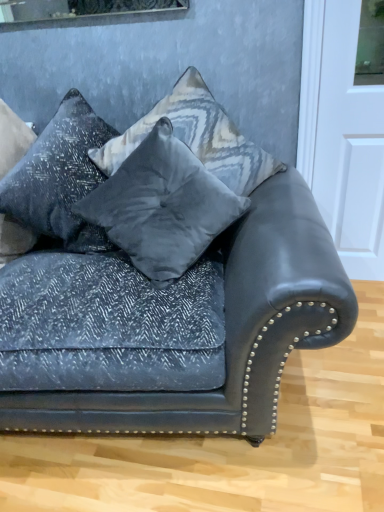
Question: Is velvet gray pillow at center, the second pillow from the left, located outside textured gray pillow at upper left, which is the 3th pillow from right to left?

Choices:
 (A) yes
 (B) no

Answer: (A)

Question: From the image's perspective, does velvet gray pillow at center, placed as the 2th pillow when sorted from right to left, appear higher than textured gray pillow at upper left, which is the first pillow in left-to-right order?

Choices:
 (A) no
 (B) yes

Answer: (A)

Question: Is textured gray pillow at upper left, which is the 3th pillow from right to left, at the back of velvet gray pillow at center, placed as the 2th pillow when sorted from right to left?

Choices:
 (A) no
 (B) yes

Answer: (A)

Question: Does velvet gray pillow at center, the second pillow from the left, have a larger size compared to textured gray pillow at upper left, which is the first pillow in left-to-right order?

Choices:
 (A) yes
 (B) no

Answer: (A)

Question: Is velvet gray pillow at center, the second pillow from the left, beside textured gray pillow at upper left, which is the first pillow in left-to-right order?

Choices:
 (A) yes
 (B) no

Answer: (B)

Question: Is textured gray pillow at upper left, which is the first pillow in left-to-right order, bigger or smaller than velvet gray pillow at center, the 1th pillow from the right?

Choices:
 (A) small
 (B) big

Answer: (A)

Question: Considering the positions of point (13, 209) and point (200, 150), is point (13, 209) closer or farther from the camera than point (200, 150)?

Choices:
 (A) closer
 (B) farther

Answer: (A)

Question: Considering the relative positions of textured gray pillow at upper left, which is the first pillow in left-to-right order, and velvet gray pillow at center, the 1th pillow from the right, in the image provided, is textured gray pillow at upper left, which is the first pillow in left-to-right order, to the left or to the right of velvet gray pillow at center, the 1th pillow from the right,?

Choices:
 (A) left
 (B) right

Answer: (A)

Question: From a real-world perspective, relative to velvet gray pillow at center, the 3th pillow in the left-to-right sequence, is textured gray pillow at upper left, which is the 3th pillow from right to left, vertically above or below?

Choices:
 (A) below
 (B) above

Answer: (A)

Question: Is textured gray pillow at upper left, which is the 3th pillow from right to left, inside the boundaries of velvet gray pillow at center, placed as the 2th pillow when sorted from right to left, or outside?

Choices:
 (A) inside
 (B) outside

Answer: (B)

Question: Looking at the image, does textured gray pillow at upper left, which is the first pillow in left-to-right order, seem bigger or smaller compared to velvet gray pillow at center, placed as the 2th pillow when sorted from right to left?

Choices:
 (A) small
 (B) big

Answer: (A)

Question: From the image's perspective, is textured gray pillow at upper left, which is the first pillow in left-to-right order, positioned above or below velvet gray pillow at center, the second pillow from the left?

Choices:
 (A) below
 (B) above

Answer: (B)

Question: Is point (51, 152) closer or farther from the camera than point (130, 242)?

Choices:
 (A) farther
 (B) closer

Answer: (A)

Question: Looking at their shapes, would you say velvet gray pillow at center, the 3th pillow in the left-to-right sequence, is wider or thinner than velvet dark blue couch at center?

Choices:
 (A) wide
 (B) thin

Answer: (B)

Question: Considering their positions, is velvet gray pillow at center, the 3th pillow in the left-to-right sequence, located in front of or behind velvet dark blue couch at center?

Choices:
 (A) behind
 (B) front

Answer: (A)